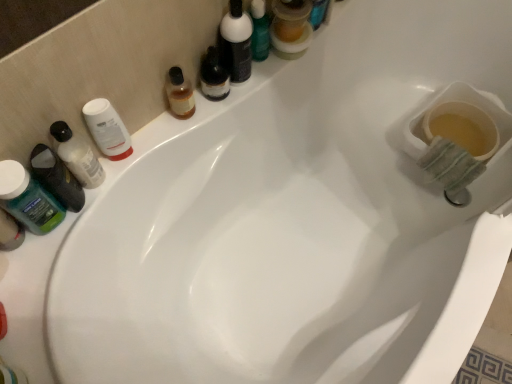
Question: Can you confirm if translucent plastic mouthwash at upper center, which appears as the 5th mouthwash when viewed from the left, is positioned to the right of matte black bottle at upper center, arranged as the 2th toiletry when viewed from the left?

Choices:
 (A) yes
 (B) no

Answer: (A)

Question: From a real-world perspective, is translucent plastic mouthwash at upper center, positioned as the first mouthwash in right-to-left order, physically below matte black bottle at upper center, which appears as the first toiletry when viewed from the top?

Choices:
 (A) no
 (B) yes

Answer: (B)

Question: Considering the relative sizes of translucent plastic mouthwash at upper center, which appears as the 5th mouthwash when viewed from the left, and matte black bottle at upper center, the first toiletry in the right-to-left sequence, in the image provided, is translucent plastic mouthwash at upper center, which appears as the 5th mouthwash when viewed from the left, shorter than matte black bottle at upper center, the first toiletry in the right-to-left sequence,?

Choices:
 (A) yes
 (B) no

Answer: (A)

Question: Does translucent plastic mouthwash at upper center, positioned as the first mouthwash in right-to-left order, appear on the left side of matte black bottle at upper center, the 2th toiletry ordered from the bottom?

Choices:
 (A) yes
 (B) no

Answer: (B)

Question: From the image's perspective, is translucent plastic mouthwash at upper center, which appears as the 5th mouthwash when viewed from the left, located above matte black bottle at upper center, which appears as the first toiletry when viewed from the top?

Choices:
 (A) no
 (B) yes

Answer: (B)

Question: Relative to translucent amber liquid at upper center, the 4th mouthwash when ordered from left to right, is matte black bottle at upper center, the first toiletry in the right-to-left sequence, in front or behind?

Choices:
 (A) front
 (B) behind

Answer: (A)

Question: From the image's perspective, is matte black bottle at upper center, the first toiletry in the right-to-left sequence, positioned above or below translucent amber liquid at upper center, the 2th mouthwash viewed from the right?

Choices:
 (A) above
 (B) below

Answer: (A)

Question: Looking at their shapes, would you say matte black bottle at upper center, which appears as the first toiletry when viewed from the top, is wider or thinner than translucent amber liquid at upper center, the 4th mouthwash when ordered from left to right?

Choices:
 (A) wide
 (B) thin

Answer: (A)

Question: Is matte black bottle at upper center, arranged as the 2th toiletry when viewed from the left, spatially inside translucent amber liquid at upper center, the 2th mouthwash viewed from the right, or outside of it?

Choices:
 (A) outside
 (B) inside

Answer: (A)

Question: Based on their positions, is matte black bottle at upper center, the 2th toiletry ordered from the bottom, located to the left or right of translucent plastic mouthwash at left, the fourth mouthwash from the right?

Choices:
 (A) left
 (B) right

Answer: (B)

Question: From a real-world perspective, is matte black bottle at upper center, the first toiletry in the right-to-left sequence, above or below translucent plastic mouthwash at left, the fourth mouthwash from the right?

Choices:
 (A) below
 (B) above

Answer: (B)

Question: Considering the positions of matte black bottle at upper center, the first toiletry in the right-to-left sequence, and translucent plastic mouthwash at left, the fourth mouthwash from the right, in the image, is matte black bottle at upper center, the first toiletry in the right-to-left sequence, bigger or smaller than translucent plastic mouthwash at left, the fourth mouthwash from the right,?

Choices:
 (A) big
 (B) small

Answer: (A)

Question: Considering the positions of matte black bottle at upper center, arranged as the 2th toiletry when viewed from the left, and translucent plastic mouthwash at left, acting as the 2th mouthwash starting from the left, in the image, is matte black bottle at upper center, arranged as the 2th toiletry when viewed from the left, wider or thinner than translucent plastic mouthwash at left, acting as the 2th mouthwash starting from the left,?

Choices:
 (A) thin
 (B) wide

Answer: (A)

Question: In the image, is translucent amber liquid at upper center, the 2th mouthwash viewed from the right, positioned in front of or behind matte black bottle at upper center, the 2th toiletry ordered from the bottom?

Choices:
 (A) front
 (B) behind

Answer: (B)

Question: From a real-world perspective, is translucent amber liquid at upper center, the 2th mouthwash viewed from the right, positioned above or below matte black bottle at upper center, the 2th toiletry ordered from the bottom?

Choices:
 (A) above
 (B) below

Answer: (B)